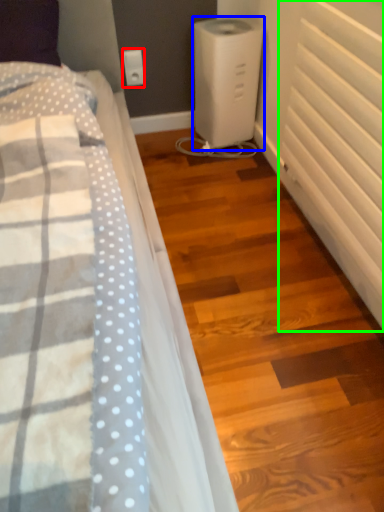
Question: Which object is the farthest from electric outlet (highlighted by a red box)? Choose among these: home appliance (highlighted by a blue box) or radiator (highlighted by a green box).

Choices:
 (A) home appliance
 (B) radiator

Answer: (B)